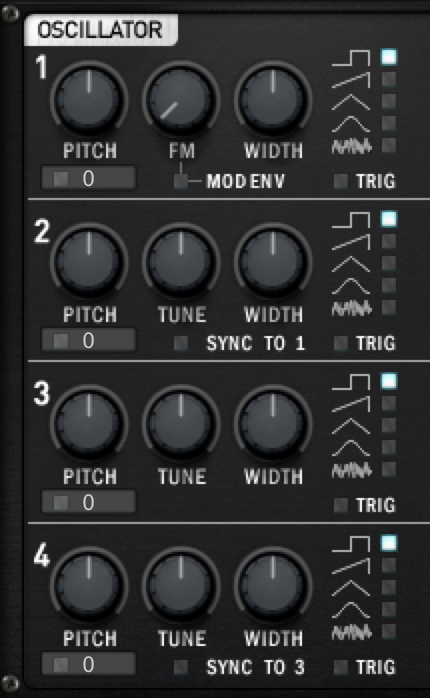
Find the location of a particular element. darkened lights is located at coordinates (385, 406), (384, 423), (383, 445), (391, 470).